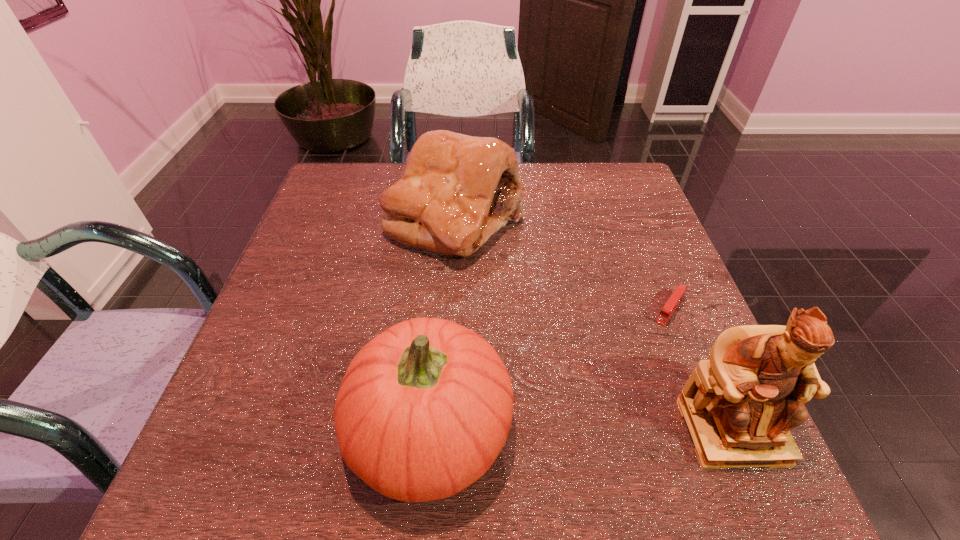
Image resolution: width=960 pixels, height=540 pixels. What are the coordinates of `vacant area that lies between the pumpkin and the tallest object` in the screenshot? It's located at (581, 429).

Where is `object that is the nearest to the pumpkin`? object that is the nearest to the pumpkin is located at coordinates (457, 190).

The height and width of the screenshot is (540, 960). In order to click on object that can be found as the second closest to the figurine in this screenshot , I will do `click(424, 409)`.

Where is `blank area in the image that satisfies the following two spatial constraints: 1. on the back side of the pumpkin; 2. on the right side of the stapler`? This screenshot has width=960, height=540. blank area in the image that satisfies the following two spatial constraints: 1. on the back side of the pumpkin; 2. on the right side of the stapler is located at coordinates (440, 308).